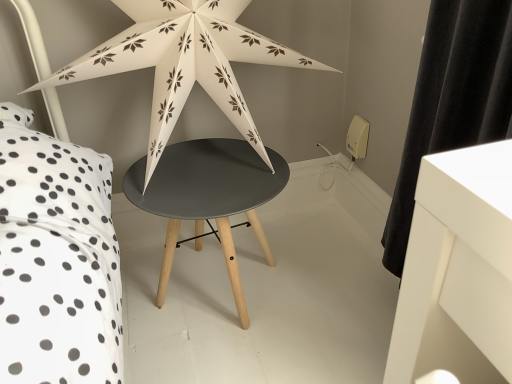
This screenshot has width=512, height=384. Describe the element at coordinates (208, 197) in the screenshot. I see `matte gray stool at center` at that location.

I want to click on matte gray stool at center, so click(x=208, y=197).

You are a GUI agent. You are given a task and a screenshot of the screen. Output one action in this format:
    pyautogui.click(x=<x>, y=<y>)
    Task: Click on the matte gray stool at center
    Image resolution: width=512 pixels, height=384 pixels.
    Given the screenshot: What is the action you would take?
    pyautogui.click(x=208, y=197)